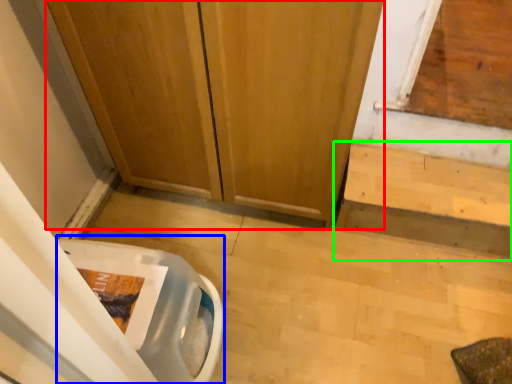
Question: Which is nearer to the door (highlighted by a red box)? toilet bowl (highlighted by a blue box) or stairwell (highlighted by a green box).

Choices:
 (A) toilet bowl
 (B) stairwell

Answer: (B)